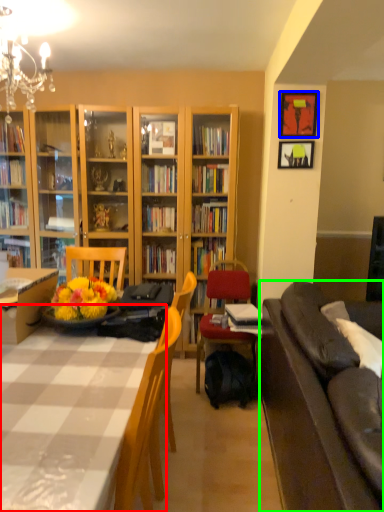
Question: Which is nearer to the table (highlighted by a red box)? picture frame (highlighted by a blue box) or studio couch (highlighted by a green box).

Choices:
 (A) picture frame
 (B) studio couch

Answer: (B)